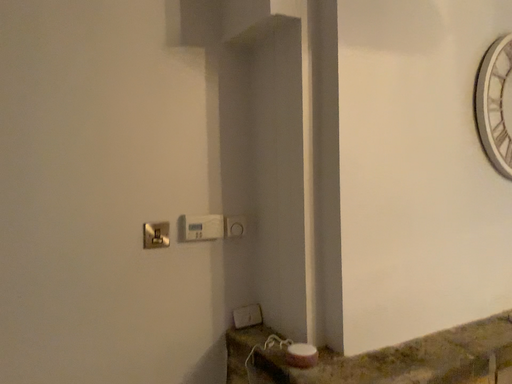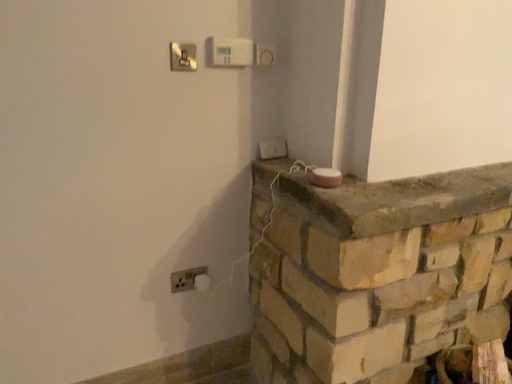
Question: Which way did the camera rotate in the video?

Choices:
 (A) rotated downward
 (B) rotated upward

Answer: (A)